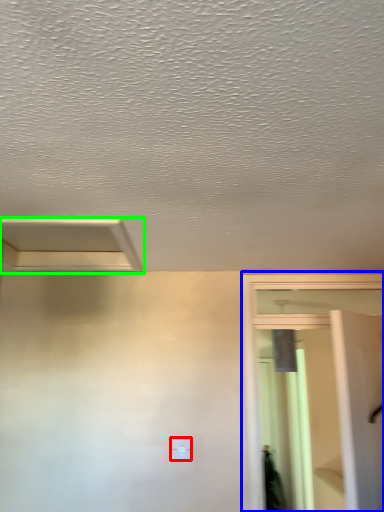
Question: Which object is positioned closest to light switch (highlighted by a red box)? Select from screen door (highlighted by a blue box) and exhaust hood (highlighted by a green box).

Choices:
 (A) screen door
 (B) exhaust hood

Answer: (A)